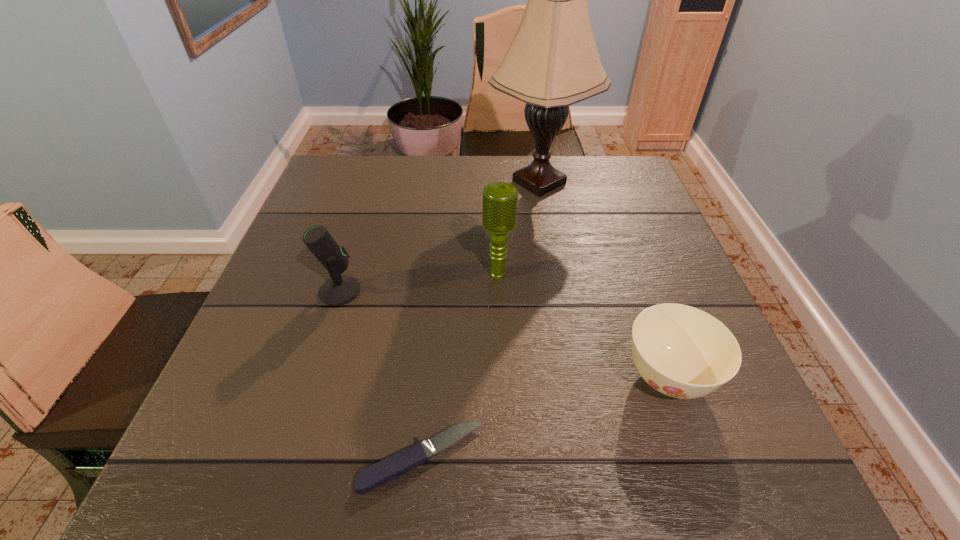
Find the location of a particular element. Image resolution: width=960 pixels, height=540 pixels. free space between the shorter microphone and the second shortest object is located at coordinates (503, 334).

Find the location of a particular element. free space between the third shortest object and the right microphone is located at coordinates (419, 283).

Where is `vacant space that is in between the nearest object and the taller microphone`? The height and width of the screenshot is (540, 960). vacant space that is in between the nearest object and the taller microphone is located at coordinates (460, 366).

I want to click on free spot between the fourth shortest object and the leftmost object, so click(x=419, y=283).

I want to click on empty space that is in between the fourth farthest object and the steak knife, so click(x=545, y=418).

In order to click on vacant area between the farthest object and the shortest object in this screenshot , I will do `click(481, 320)`.

You are a GUI agent. You are given a task and a screenshot of the screen. Output one action in this format:
    pyautogui.click(x=<x>, y=<y>)
    Task: Click on the vacant space that is in between the farthest object and the nearest object
    This screenshot has width=960, height=540.
    Given the screenshot: What is the action you would take?
    tap(481, 320)

Locate an element on the screen. The width and height of the screenshot is (960, 540). the closest object to the second shortest object is located at coordinates (500, 199).

At what (x,y) coordinates should I click in order to perform the action: click on object that is the second closest to the steak knife. Please return your answer as a coordinate pair (x, y). Image resolution: width=960 pixels, height=540 pixels. Looking at the image, I should click on (340, 289).